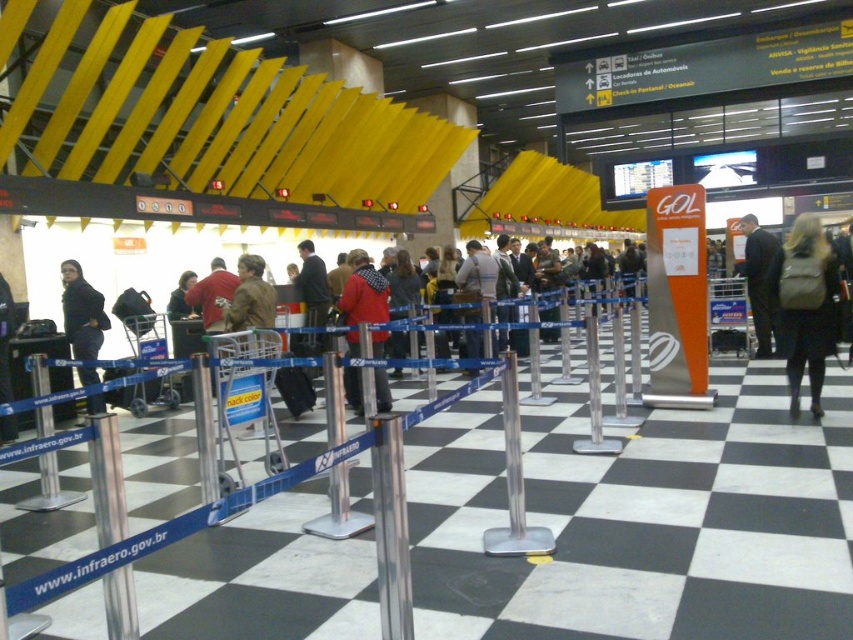
Question: Is leather backpack at right thinner than silver metallic pole at center?

Choices:
 (A) no
 (B) yes

Answer: (A)

Question: Which object appears farthest from the camera in this image?

Choices:
 (A) silver metallic stanchion at center
 (B) silver metallic pole at lower left

Answer: (A)

Question: Which of the following is the farthest from the observer?

Choices:
 (A) silver metallic stanchion at center
 (B) leather backpack at right

Answer: (B)

Question: Does leather backpack at right have a larger size compared to silver metallic pole at lower left?

Choices:
 (A) yes
 (B) no

Answer: (B)

Question: Which object is positioned closest to the silver metallic stanchion at center?

Choices:
 (A) leather backpack at right
 (B) red woolen sweater at center
 (C) dark suit at right

Answer: (B)

Question: Can you confirm if leather backpack at right is positioned below silver metallic pole at center?

Choices:
 (A) no
 (B) yes

Answer: (A)